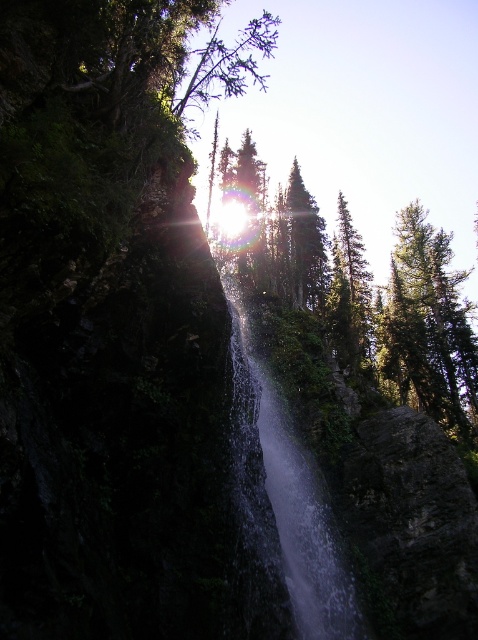
Consider the image. You are standing at the center of the image and want to locate the green textured tree at center. According to the coordinates provided, in which direction should you look to find it?

The green textured tree at center is located at coordinates point (359, 291), which means it is slightly to the right and above the center point. Therefore, you should look slightly to the right and upwards from the center to find it.

You are a bird flying over the waterfall scene. You notice two green trees at the upper center of the image. Which tree is positioned lower between the green matte tree at upper center and the green textured tree at upper center?

The green matte tree at upper center is positioned lower than the green textured tree at upper center according to the description.